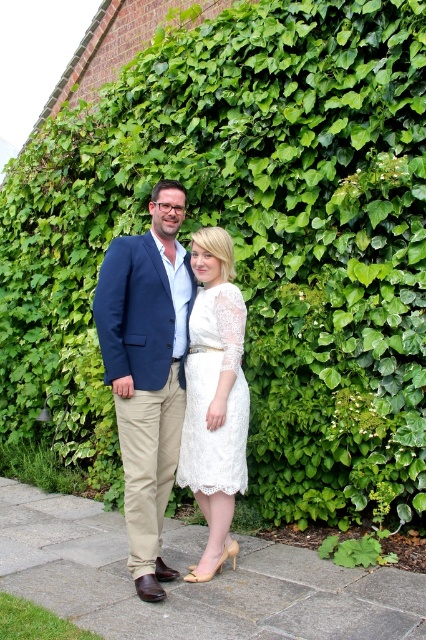
You are a photographer setting up for a portrait. You see the navy blue blazer at center and the white lace dress at center. Which clothing item should you focus on first if you want to capture the person on the left?

The navy blue blazer at center belongs to the person on the left, so you should focus on the navy blue blazer at center first.

You are a photographer planning to take a portrait of the two people in the image. You want to ensure that the navy blue blazer at center is clearly visible in the frame. Where should you position the camera relative to the point at coordinates point [147,371]?

The navy blue blazer at center is located at point [147,371], so positioning the camera directly at that point would center the blazer in the frame, ensuring it is clearly visible.

You are a photographer setting up for a photoshoot. You need to ensure that the navy blue blazer at center and the white lace dress at center are both visible in the frame. Based on their positions, which clothing item is covering part of the other?

The navy blue blazer at center is positioned over the white lace dress at center, so it is covering part of the dress.